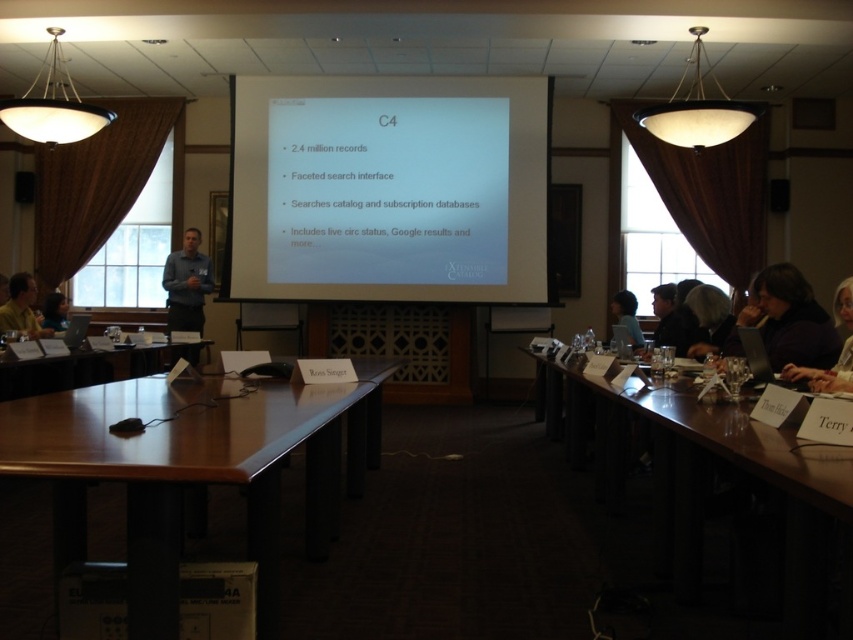
Who is positioned more to the left, white matte projector screen at center or white hair at upper right?

white matte projector screen at center

From the picture: Does white matte projector screen at center appear on the right side of white hair at upper right?

In fact, white matte projector screen at center is to the left of white hair at upper right.

Consider the image. Measure the distance between point (351, 189) and camera.

The distance of point (351, 189) from camera is 7.71 meters.

This screenshot has width=853, height=640. In order to click on white matte projector screen at center in this screenshot , I will do `click(387, 189)`.

Which is in front, point (636, 340) or point (45, 321)?

Point (636, 340)

I want to click on matte black laptop at center, so click(627, 316).

Where is `matte black laptop at center`? matte black laptop at center is located at coordinates point(627,316).

Where is `matte black laptop at center`? This screenshot has width=853, height=640. matte black laptop at center is located at coordinates (627, 316).

Does brown wooden table at center appear on the right side of gray shirt at center?

Indeed, brown wooden table at center is positioned on the right side of gray shirt at center.

Is brown wooden table at center positioned behind gray shirt at center?

No, it is in front of gray shirt at center.

Identify the location of brown wooden table at center. (78, 369).

You are a GUI agent. You are given a task and a screenshot of the screen. Output one action in this format:
    pyautogui.click(x=<x>, y=<y>)
    Task: Click on the brown wooden table at center
    The height and width of the screenshot is (640, 853).
    Given the screenshot: What is the action you would take?
    pyautogui.click(x=78, y=369)